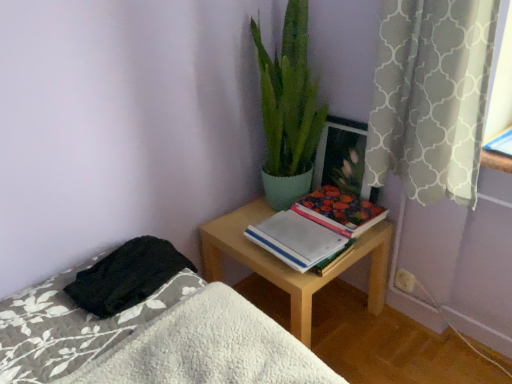
Locate an element on the screen. light wood desk at center is located at coordinates (287, 266).

What do you see at coordinates (342, 157) in the screenshot? I see `wooden picture frame at upper right` at bounding box center [342, 157].

What do you see at coordinates (296, 240) in the screenshot? The height and width of the screenshot is (384, 512). I see `white paper notebook at center` at bounding box center [296, 240].

Identify the location of green matte plant at upper center. The width and height of the screenshot is (512, 384). (289, 110).

This screenshot has width=512, height=384. What do you see at coordinates (431, 96) in the screenshot?
I see `gray textured curtain at upper right` at bounding box center [431, 96].

Locate an element on the screen. The height and width of the screenshot is (384, 512). black fuzzy blanket at lower left is located at coordinates 127,276.

From a real-world perspective, which is physically below, white fluffy bed at lower left or light wood desk at center?

From a 3D spatial view, light wood desk at center is below.

From the picture: Considering the relative sizes of white fluffy bed at lower left and light wood desk at center in the image provided, is white fluffy bed at lower left wider than light wood desk at center?

No.

Who is bigger, white fluffy bed at lower left or light wood desk at center?

light wood desk at center.

From the image's perspective, who appears lower, white fluffy bed at lower left or light wood desk at center?

white fluffy bed at lower left appears lower in the image.

Does hardcover floral book at center-right contain green matte plant at upper center?

Actually, green matte plant at upper center is outside hardcover floral book at center-right.

Which object is wider, hardcover floral book at center-right or green matte plant at upper center?

With larger width is green matte plant at upper center.

Which is more to the left, hardcover floral book at center-right or green matte plant at upper center?

green matte plant at upper center is more to the left.

Looking at this image, does hardcover floral book at center-right turn towards green matte plant at upper center?

No, hardcover floral book at center-right is not aimed at green matte plant at upper center.

Between white paper notebook at center and white fluffy bed at lower left, which one is positioned behind?

white paper notebook at center is more distant.

Locate an element on the screen. The height and width of the screenshot is (384, 512). notebook on the right of white fluffy bed at lower left is located at coordinates (296, 240).

Is white paper notebook at center not near white fluffy bed at lower left?

white paper notebook at center is actually quite close to white fluffy bed at lower left.

Considering the sizes of objects white paper notebook at center and white fluffy bed at lower left in the image provided, who is bigger, white paper notebook at center or white fluffy bed at lower left?

Bigger between the two is white fluffy bed at lower left.

How different are the orientations of white plastic electric outlet at lower right and light wood desk at center in degrees?

0.507 degrees separate the facing orientations of white plastic electric outlet at lower right and light wood desk at center.

Between white plastic electric outlet at lower right and light wood desk at center, which one is positioned in front?

light wood desk at center is closer to the camera.

Is white plastic electric outlet at lower right next to light wood desk at center and touching it?

white plastic electric outlet at lower right is not next to light wood desk at center, and they're not touching.

Considering the positions of objects white plastic electric outlet at lower right and light wood desk at center in the image provided, who is more to the right, white plastic electric outlet at lower right or light wood desk at center?

white plastic electric outlet at lower right.

Based on the photo, can you confirm if wooden picture frame at upper right is shorter than white paper notebook at center?

No.

Does point (355, 138) come closer to viewer compared to point (259, 241)?

No, (355, 138) is behind (259, 241).

Locate an element on the screen. This screenshot has width=512, height=384. picture frame that appears on the right of white paper notebook at center is located at coordinates (342, 157).

Is wooden picture frame at upper right in contact with white paper notebook at center?

No.

Considering the sizes of objects wooden picture frame at upper right and light wood desk at center in the image provided, who is wider, wooden picture frame at upper right or light wood desk at center?

light wood desk at center.

In the scene shown: Is wooden picture frame at upper right aimed at light wood desk at center?

No.

Is wooden picture frame at upper right completely or partially outside of light wood desk at center?

That's correct, wooden picture frame at upper right is outside of light wood desk at center.

Which is behind, point (329, 178) or point (300, 300)?

The point (329, 178) is behind.

Which of these two, light wood desk at center or white fluffy bed at lower left, is smaller?

Smaller between the two is white fluffy bed at lower left.

Between light wood desk at center and white fluffy bed at lower left, which one has smaller width?

white fluffy bed at lower left.

Is light wood desk at center shorter than white fluffy bed at lower left?

No, light wood desk at center is not shorter than white fluffy bed at lower left.

How many degrees apart are the facing directions of light wood desk at center and white fluffy bed at lower left?

light wood desk at center and white fluffy bed at lower left are facing 179 degrees away from each other.

I want to click on desk on the right of white fluffy bed at lower left, so click(x=287, y=266).

Find the location of a particular element. Image resolution: width=512 pixels, height=384 pixels. houseplant that is above the hardcover floral book at center-right (from a real-world perspective) is located at coordinates (289, 110).

Looking at the image, which one is located closer to green matte plant at upper center, white fluffy bed at lower left or light wood desk at center?

light wood desk at center is positioned closer to the anchor green matte plant at upper center.

Based on their spatial positions, is white paper notebook at center or wooden picture frame at upper right closer to white plastic electric outlet at lower right?

wooden picture frame at upper right lies closer to white plastic electric outlet at lower right than the other object.

From the image, which object appears to be nearer to white paper notebook at center, wooden picture frame at upper right or light wood desk at center?

light wood desk at center.

When comparing their distances from white plastic electric outlet at lower right, does wooden picture frame at upper right or black fuzzy blanket at lower left seem closer?

Among the two, wooden picture frame at upper right is located nearer to white plastic electric outlet at lower right.

Which object lies nearer to the anchor point white plastic electric outlet at lower right, light wood desk at center or white paper notebook at center?

Based on the image, light wood desk at center appears to be nearer to white plastic electric outlet at lower right.

Which object lies further to the anchor point gray textured curtain at upper right, black fuzzy blanket at lower left or hardcover floral book at center-right?

black fuzzy blanket at lower left.

Estimate the real-world distances between objects in this image. Which object is further from light wood desk at center, white fluffy bed at lower left or green matte plant at upper center?

Based on the image, white fluffy bed at lower left appears to be further to light wood desk at center.

Estimate the real-world distances between objects in this image. Which object is closer to white plastic electric outlet at lower right, hardcover floral book at center-right or wooden picture frame at upper right?

hardcover floral book at center-right is closer to white plastic electric outlet at lower right.

Find the location of a particular element. This screenshot has width=512, height=384. houseplant between gray textured curtain at upper right and hardcover floral book at center-right in the front-back direction is located at coordinates (289, 110).

This screenshot has width=512, height=384. I want to click on desk between black fuzzy blanket at lower left and wooden picture frame at upper right from left to right, so click(287, 266).

The width and height of the screenshot is (512, 384). I want to click on desk located between white fluffy bed at lower left and white plastic electric outlet at lower right in the depth direction, so pyautogui.click(x=287, y=266).

You are a GUI agent. You are given a task and a screenshot of the screen. Output one action in this format:
    pyautogui.click(x=<x>, y=<y>)
    Task: Click on the desk located between gray textured curtain at upper right and wooden picture frame at upper right in the depth direction
    
    Given the screenshot: What is the action you would take?
    pyautogui.click(x=287, y=266)